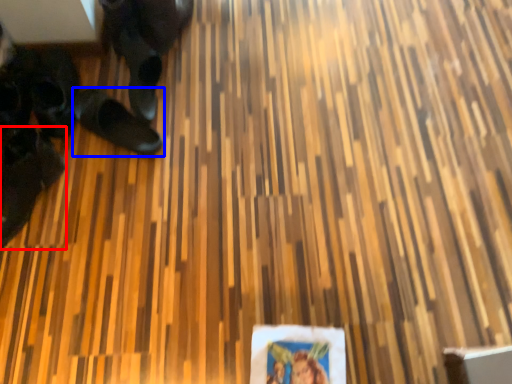
Question: Which object is closer to the camera taking this photo, footwear (highlighted by a red box) or footwear (highlighted by a blue box)?

Choices:
 (A) footwear
 (B) footwear

Answer: (A)